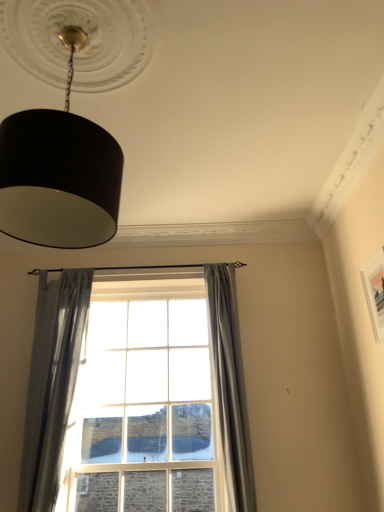
The height and width of the screenshot is (512, 384). What do you see at coordinates (230, 382) in the screenshot?
I see `clear glass window at center` at bounding box center [230, 382].

The height and width of the screenshot is (512, 384). I want to click on gray sheer curtain at left, which ranks as the 2th curtain in right-to-left order, so click(52, 384).

Does gray fabric curtain at center, which is the second curtain in left-to-right order, appear on the right side of black matte lampshade at upper left?

Indeed, gray fabric curtain at center, which is the second curtain in left-to-right order, is positioned on the right side of black matte lampshade at upper left.

Is point (225, 334) closer or farther from the camera than point (45, 212)?

Point (225, 334) is farther from the camera than point (45, 212).

Which of these two, gray fabric curtain at center, which is the second curtain in left-to-right order, or black matte lampshade at upper left, is smaller?

Answer: gray fabric curtain at center, which is the second curtain in left-to-right order, is smaller.

From the image's perspective, is clear glass window at center on top of black matte lampshade at upper left?

No, from the image's perspective, clear glass window at center is not above black matte lampshade at upper left.

Is clear glass window at center shorter than black matte lampshade at upper left?

Incorrect, the height of clear glass window at center does not fall short of that of black matte lampshade at upper left.

Is clear glass window at center positioned with its back to black matte lampshade at upper left?

No, clear glass window at center's orientation is not away from black matte lampshade at upper left.

Considering the sizes of objects clear glass window at center and gray fabric curtain at center, placed as the first curtain when sorted from right to left, in the image provided, who is wider, clear glass window at center or gray fabric curtain at center, placed as the first curtain when sorted from right to left,?

Wider between the two is gray fabric curtain at center, placed as the first curtain when sorted from right to left.

Does point (211, 290) lie behind point (228, 380)?

Yes, point (211, 290) is behind point (228, 380).

Considering their positions, is black matte lampshade at upper left located in front of or behind gray fabric curtain at center, placed as the first curtain when sorted from right to left?

In the image, black matte lampshade at upper left appears in front of gray fabric curtain at center, placed as the first curtain when sorted from right to left.

In terms of height, does black matte lampshade at upper left look taller or shorter compared to gray fabric curtain at center, which is the second curtain in left-to-right order?

Clearly, black matte lampshade at upper left is shorter compared to gray fabric curtain at center, which is the second curtain in left-to-right order.

Which is less distant, (45, 220) or (209, 270)?

The point (45, 220) is closer.

From the image's perspective, which one is positioned higher, black matte lampshade at upper left or gray fabric curtain at center, placed as the first curtain when sorted from right to left?

black matte lampshade at upper left.

From the image's perspective, is black matte lampshade at upper left located beneath gray sheer curtain at left, which ranks as the 2th curtain in right-to-left order?

Incorrect, from the image's perspective, black matte lampshade at upper left is higher than gray sheer curtain at left, which ranks as the 2th curtain in right-to-left order.

Is black matte lampshade at upper left oriented towards gray sheer curtain at left, which ranks as the 2th curtain in right-to-left order?

No, black matte lampshade at upper left is not facing towards gray sheer curtain at left, which ranks as the 2th curtain in right-to-left order.

From a real-world perspective, is black matte lampshade at upper left positioned under gray sheer curtain at left, the 1th curtain positioned from the left, based on gravity?

Actually, black matte lampshade at upper left is physically above gray sheer curtain at left, the 1th curtain positioned from the left, in the real world.

Which is behind, point (118, 189) or point (56, 282)?

The point (56, 282) is more distant.

Is clear glass window at center aimed at gray sheer curtain at left, which ranks as the 2th curtain in right-to-left order?

No, clear glass window at center is not facing towards gray sheer curtain at left, which ranks as the 2th curtain in right-to-left order.

Which is in front, clear glass window at center or gray sheer curtain at left, which ranks as the 2th curtain in right-to-left order?

gray sheer curtain at left, which ranks as the 2th curtain in right-to-left order, is closer to the camera.

From the image's perspective, which one is positioned lower, clear glass window at center or gray sheer curtain at left, the 1th curtain positioned from the left?

clear glass window at center.

Consider the image. Is clear glass window at center far from gray sheer curtain at left, the 1th curtain positioned from the left?

Yes, clear glass window at center and gray sheer curtain at left, the 1th curtain positioned from the left, are located far from each other.

How different are the orientations of gray sheer curtain at left, the 1th curtain positioned from the left, and clear glass window at center in degrees?

gray sheer curtain at left, the 1th curtain positioned from the left, and clear glass window at center are facing 0.000104 degrees away from each other.

Who is taller, gray sheer curtain at left, the 1th curtain positioned from the left, or clear glass window at center?

clear glass window at center.

How much distance is there between gray sheer curtain at left, the 1th curtain positioned from the left, and clear glass window at center?

gray sheer curtain at left, the 1th curtain positioned from the left, is 1.03 meters from clear glass window at center.

Which object is positioned more to the right, gray sheer curtain at left, which ranks as the 2th curtain in right-to-left order, or clear glass window at center?

Positioned to the right is clear glass window at center.

This screenshot has height=512, width=384. Identify the location of lamp in front of the gray fabric curtain at center, which is the second curtain in left-to-right order. (59, 173).

The width and height of the screenshot is (384, 512). Find the location of `window located underneath the black matte lampshade at upper left (from a real-world perspective)`. window located underneath the black matte lampshade at upper left (from a real-world perspective) is located at coordinates (230, 382).

When comparing their distances from gray fabric curtain at center, which is the second curtain in left-to-right order, does black matte lampshade at upper left or clear glass window at center seem closer?

clear glass window at center lies closer to gray fabric curtain at center, which is the second curtain in left-to-right order, than the other object.

Estimate the real-world distances between objects in this image. Which object is further from gray sheer curtain at left, which ranks as the 2th curtain in right-to-left order, black matte lampshade at upper left or clear glass window at center?

Based on the image, black matte lampshade at upper left appears to be further to gray sheer curtain at left, which ranks as the 2th curtain in right-to-left order.

Looking at the image, which one is located further to black matte lampshade at upper left, gray sheer curtain at left, the 1th curtain positioned from the left, or gray fabric curtain at center, placed as the first curtain when sorted from right to left?

gray fabric curtain at center, placed as the first curtain when sorted from right to left, is positioned further to the anchor black matte lampshade at upper left.

When comparing their distances from clear glass window at center, does gray fabric curtain at center, which is the second curtain in left-to-right order, or gray sheer curtain at left, which ranks as the 2th curtain in right-to-left order, seem closer?

gray fabric curtain at center, which is the second curtain in left-to-right order, lies closer to clear glass window at center than the other object.

Considering their positions, is clear glass window at center positioned closer to gray sheer curtain at left, which ranks as the 2th curtain in right-to-left order, than gray fabric curtain at center, which is the second curtain in left-to-right order?

gray fabric curtain at center, which is the second curtain in left-to-right order, lies closer to gray sheer curtain at left, which ranks as the 2th curtain in right-to-left order, than the other object.

When comparing their distances from black matte lampshade at upper left, does gray fabric curtain at center, placed as the first curtain when sorted from right to left, or gray sheer curtain at left, which ranks as the 2th curtain in right-to-left order, seem closer?

gray sheer curtain at left, which ranks as the 2th curtain in right-to-left order, lies closer to black matte lampshade at upper left than the other object.

When comparing their distances from clear glass window at center, does gray fabric curtain at center, which is the second curtain in left-to-right order, or black matte lampshade at upper left seem closer?

The object closer to clear glass window at center is gray fabric curtain at center, which is the second curtain in left-to-right order.

When comparing their distances from clear glass window at center, does gray sheer curtain at left, which ranks as the 2th curtain in right-to-left order, or black matte lampshade at upper left seem closer?

gray sheer curtain at left, which ranks as the 2th curtain in right-to-left order, is closer to clear glass window at center.

Where is `window between gray sheer curtain at left, the 1th curtain positioned from the left, and gray fabric curtain at center, which is the second curtain in left-to-right order, in the horizontal direction`? window between gray sheer curtain at left, the 1th curtain positioned from the left, and gray fabric curtain at center, which is the second curtain in left-to-right order, in the horizontal direction is located at coordinates (230, 382).

This screenshot has height=512, width=384. In order to click on curtain between black matte lampshade at upper left and gray sheer curtain at left, which ranks as the 2th curtain in right-to-left order, from top to bottom in this screenshot , I will do pyautogui.click(x=230, y=386).